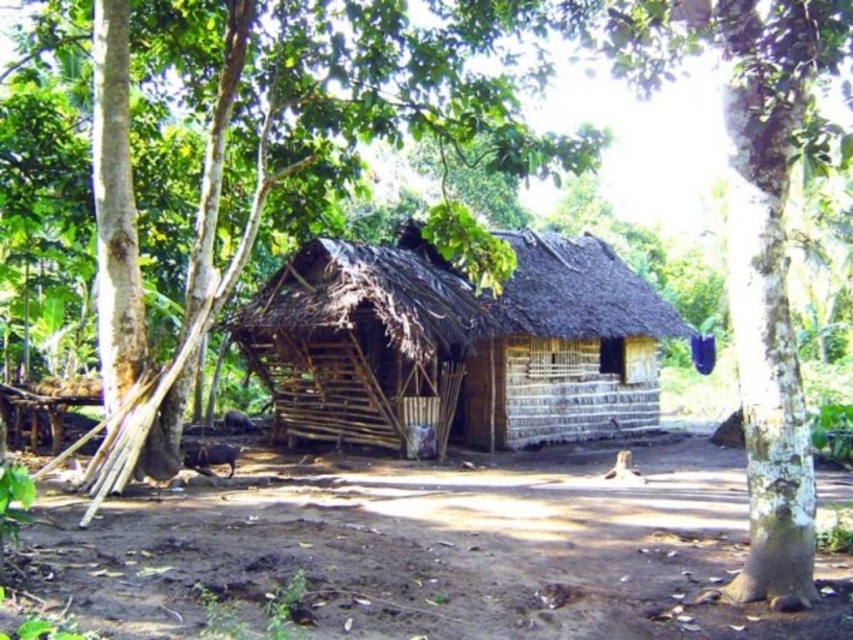
Which is more to the right, brown dirt field at center or brown wood tree at center?

Positioned to the right is brown dirt field at center.

Is brown dirt field at center thinner than brown wood tree at center?

Yes, brown dirt field at center is thinner than brown wood tree at center.

Who is more forward, (589, 586) or (345, 115)?

Point (589, 586) is more forward.

The width and height of the screenshot is (853, 640). Identify the location of brown dirt field at center. click(439, 552).

Locate an element on the screen. This screenshot has height=640, width=853. brown wood tree at center is located at coordinates (288, 164).

Is point (524, 161) less distant than point (306, 406)?

Yes, point (524, 161) is closer to viewer.

The width and height of the screenshot is (853, 640). I want to click on brown wood tree at center, so click(288, 164).

Is brown dirt field at center to the left of wooden hut at center from the viewer's perspective?

Incorrect, brown dirt field at center is not on the left side of wooden hut at center.

Image resolution: width=853 pixels, height=640 pixels. Identify the location of brown dirt field at center. (439, 552).

Where is `brown dirt field at center`? The height and width of the screenshot is (640, 853). brown dirt field at center is located at coordinates (439, 552).